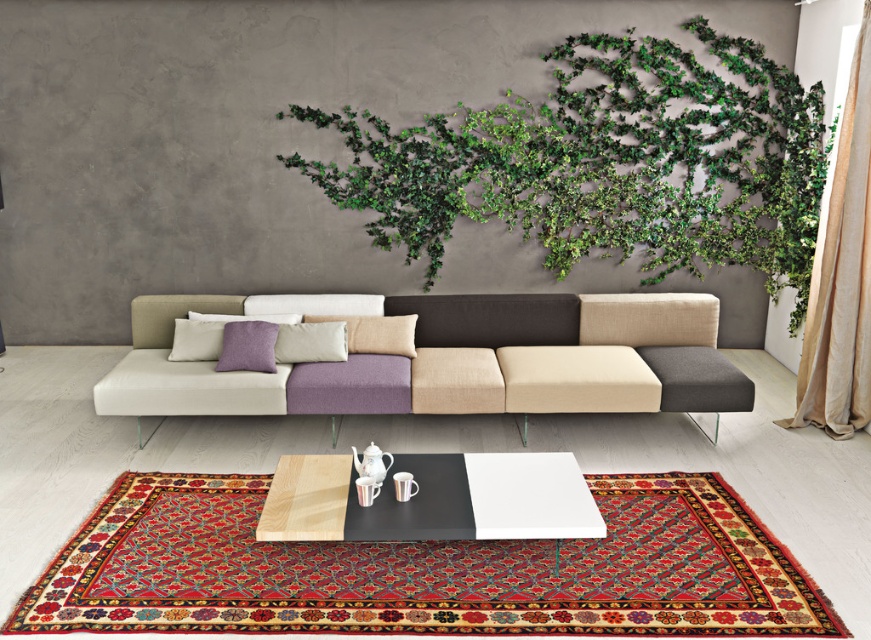
Question: Is the position of textured fabric couch at center less distant than that of purple matte pillow at center?

Choices:
 (A) no
 (B) yes

Answer: (B)

Question: Among these objects, which one is nearest to the camera?

Choices:
 (A) green leafy wall art at upper center
 (B) wooden table at center
 (C) matte gray pillow at center

Answer: (B)

Question: Can you confirm if beige fabric pillow at center is positioned to the right of matte gray pillow at center?

Choices:
 (A) no
 (B) yes

Answer: (B)

Question: Which point is farther from the camera taking this photo?

Choices:
 (A) (431, 497)
 (B) (815, 115)
 (C) (174, 348)
 (D) (253, 355)

Answer: (B)

Question: Is the position of purple matte pillow at center less distant than that of purple fabric pillow at center?

Choices:
 (A) no
 (B) yes

Answer: (B)

Question: Estimate the real-world distances between objects in this image. Which object is farther from the purple matte pillow at center?

Choices:
 (A) wooden table at center
 (B) matte gray pillow at center
 (C) purple textured pillow at center
 (D) purple fabric pillow at center

Answer: (A)